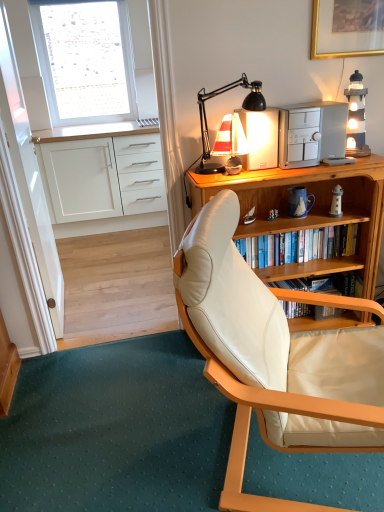
You are a GUI agent. You are given a task and a screenshot of the screen. Output one action in this format:
    pyautogui.click(x=<x>, y=<y>)
    Task: Click on the vacant region to the left of white plastic phone at upper right
    
    Given the screenshot: What is the action you would take?
    pyautogui.click(x=315, y=166)